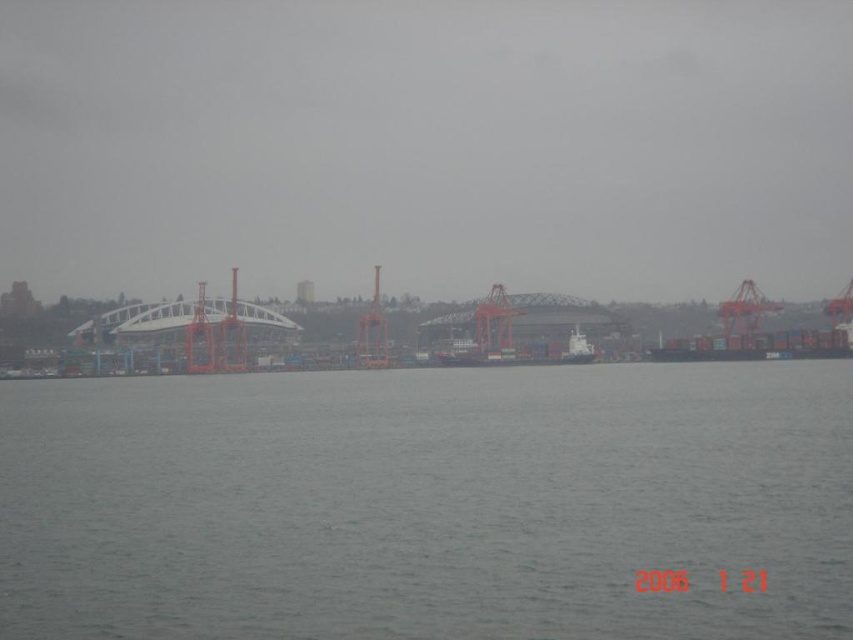
Question: Among these objects, which one is farthest from the camera?

Choices:
 (A) orange metallic crane at right
 (B) white matte container ship at center
 (C) gray water at center

Answer: (A)

Question: Does gray water at center appear on the left side of orange metallic crane at right?

Choices:
 (A) no
 (B) yes

Answer: (B)

Question: Is gray water at center to the right of orange metallic crane at right from the viewer's perspective?

Choices:
 (A) yes
 (B) no

Answer: (B)

Question: Is white matte container ship at center below orange metallic crane at right?

Choices:
 (A) no
 (B) yes

Answer: (B)

Question: Which point is closer to the camera taking this photo?

Choices:
 (A) (753, 304)
 (B) (495, 360)
 (C) (637, 444)

Answer: (C)

Question: Which point is farther to the camera?

Choices:
 (A) orange metallic crane at right
 (B) gray water at center
 (C) white matte container ship at center

Answer: (A)